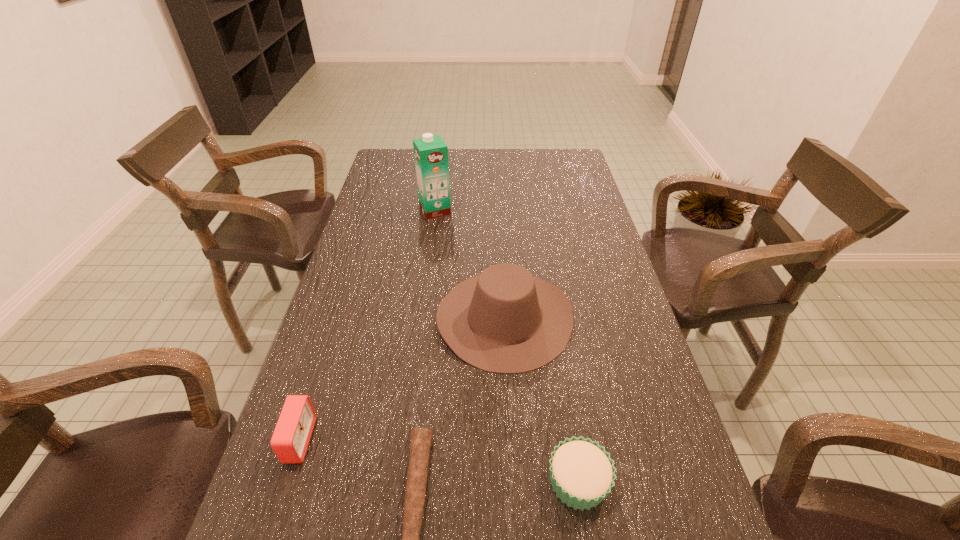
Identify the location of unoccupied area between the carton and the fourth nearest object. Image resolution: width=960 pixels, height=540 pixels. (469, 264).

Locate which object is the third closest to the shortest object. Please provide its 2D coordinates. Your answer should be formatted as a tuple, i.e. [(x, y)], where the tuple contains the x and y coordinates of a point satisfying the conditions above.

[(582, 474)]

The image size is (960, 540). I want to click on object that ranks as the fourth closest to the cupcake, so click(430, 152).

Where is `free spot that satisfies the following two spatial constraints: 1. on the front-facing side of the second shortest object; 2. on the left side of the alarm clock`? The width and height of the screenshot is (960, 540). free spot that satisfies the following two spatial constraints: 1. on the front-facing side of the second shortest object; 2. on the left side of the alarm clock is located at coordinates (285, 482).

Identify the location of vacant space that satisfies the following two spatial constraints: 1. on the front side of the fourth nearest object; 2. on the left side of the cupcake. The image size is (960, 540). (514, 482).

I want to click on free spot that satisfies the following two spatial constraints: 1. on the back side of the fourth tallest object; 2. on the front-facing side of the leftmost object, so click(571, 440).

Identify the location of vacant point that satisfies the following two spatial constraints: 1. on the front-facing side of the third tallest object; 2. on the right side of the second shortest object. (285, 482).